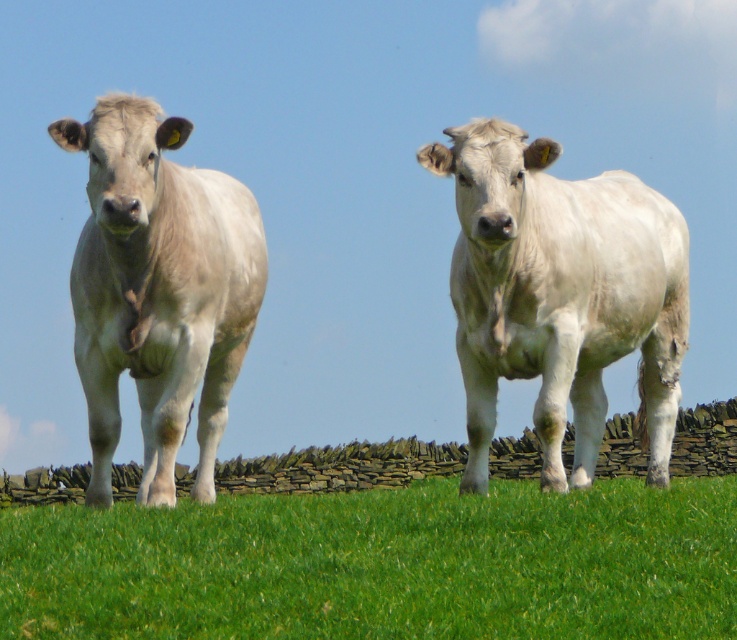
Does white matte cow at center appear on the right side of light gray smooth cow at center?

Indeed, white matte cow at center is positioned on the right side of light gray smooth cow at center.

Which of these two, white matte cow at center or light gray smooth cow at center, stands taller?

Standing taller between the two is light gray smooth cow at center.

Who is more distant from viewer, (559,449) or (80,328)?

The point (80,328) is more distant.

Find the location of a particular element. Image resolution: width=737 pixels, height=640 pixels. white matte cow at center is located at coordinates (559, 294).

Does green grass at lower center appear over light gray smooth cow at center?

Actually, green grass at lower center is below light gray smooth cow at center.

Is point (356, 513) in front of point (172, 237)?

No, (356, 513) is further to viewer.

Where is `green grass at lower center`? This screenshot has width=737, height=640. green grass at lower center is located at coordinates (380, 564).

Is point (41, 552) farther from viewer compared to point (559, 346)?

No, (41, 552) is in front of (559, 346).

Describe the element at coordinates (380, 564) in the screenshot. I see `green grass at lower center` at that location.

Where is `green grass at lower center`? green grass at lower center is located at coordinates click(380, 564).